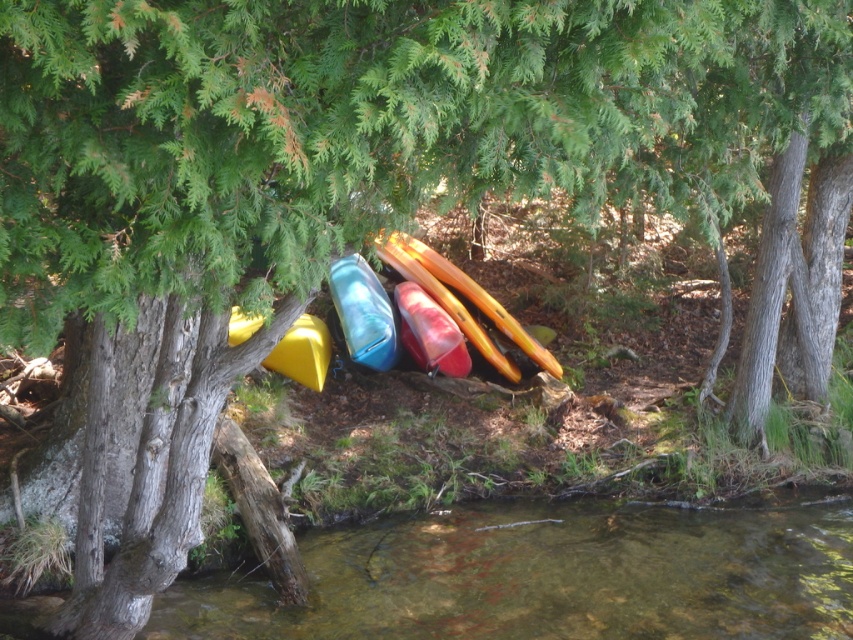
Is translucent blue kayak at center bigger than matte red canoe at center?

Yes.

Is point (344, 284) behind point (410, 340)?

Yes, point (344, 284) is behind point (410, 340).

Measure the distance between translucent blue kayak at center and camera.

The distance of translucent blue kayak at center from camera is 37.16 feet.

Identify the location of translucent blue kayak at center. (363, 314).

Who is shorter, yellow matte kayak at center or translucent red kayak at center?

With less height is translucent red kayak at center.

Between point (306, 339) and point (425, 284), which one is positioned in front?

Positioned in front is point (306, 339).

Between point (316, 332) and point (508, 369), which one is positioned in front?

Point (316, 332)

Where is `yellow matte kayak at center`? The width and height of the screenshot is (853, 640). yellow matte kayak at center is located at coordinates (302, 353).

Measure the distance between clear water at lower center and camera.

A distance of 23.52 feet exists between clear water at lower center and camera.

Can you confirm if clear water at lower center is bigger than matte red canoe at center?

No.

The height and width of the screenshot is (640, 853). What are the coordinates of `clear water at lower center` in the screenshot? It's located at (548, 577).